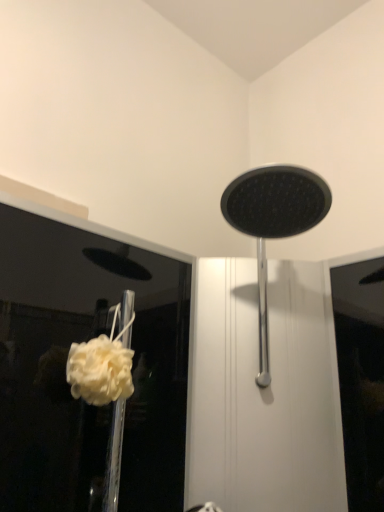
Question: Does polished chrome shower head at center have a greater width compared to white fluffy sponge at lower left?

Choices:
 (A) no
 (B) yes

Answer: (B)

Question: Is polished chrome shower head at center closer to camera compared to white fluffy sponge at lower left?

Choices:
 (A) yes
 (B) no

Answer: (A)

Question: Is polished chrome shower head at center touching white fluffy sponge at lower left?

Choices:
 (A) yes
 (B) no

Answer: (B)

Question: From a real-world perspective, is polished chrome shower head at center physically above white fluffy sponge at lower left?

Choices:
 (A) no
 (B) yes

Answer: (B)

Question: Can you confirm if polished chrome shower head at center is positioned to the left of white fluffy sponge at lower left?

Choices:
 (A) no
 (B) yes

Answer: (A)

Question: Does polished chrome shower head at center have a lesser height compared to white fluffy sponge at lower left?

Choices:
 (A) no
 (B) yes

Answer: (A)

Question: Considering the relative sizes of white fluffy sponge at lower left and polished chrome shower head at center in the image provided, is white fluffy sponge at lower left thinner than polished chrome shower head at center?

Choices:
 (A) yes
 (B) no

Answer: (A)

Question: Is white fluffy sponge at lower left at the right side of polished chrome shower head at center?

Choices:
 (A) yes
 (B) no

Answer: (B)

Question: From the image's perspective, is white fluffy sponge at lower left on top of polished chrome shower head at center?

Choices:
 (A) yes
 (B) no

Answer: (B)

Question: Is white fluffy sponge at lower left further to the viewer compared to polished chrome shower head at center?

Choices:
 (A) no
 (B) yes

Answer: (B)

Question: Is white fluffy sponge at lower left not inside polished chrome shower head at center?

Choices:
 (A) yes
 (B) no

Answer: (A)

Question: Is polished chrome shower head at center at the back of white fluffy sponge at lower left?

Choices:
 (A) yes
 (B) no

Answer: (B)

Question: Considering the positions of polished chrome shower head at center and white fluffy sponge at lower left in the image, is polished chrome shower head at center wider or thinner than white fluffy sponge at lower left?

Choices:
 (A) wide
 (B) thin

Answer: (A)